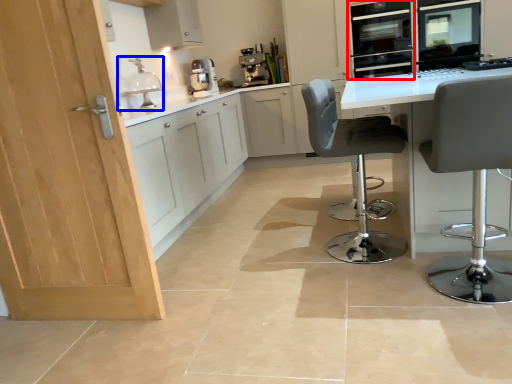
Question: Which object is closer to the camera taking this photo, oven (highlighted by a red box) or sink (highlighted by a blue box)?

Choices:
 (A) oven
 (B) sink

Answer: (B)